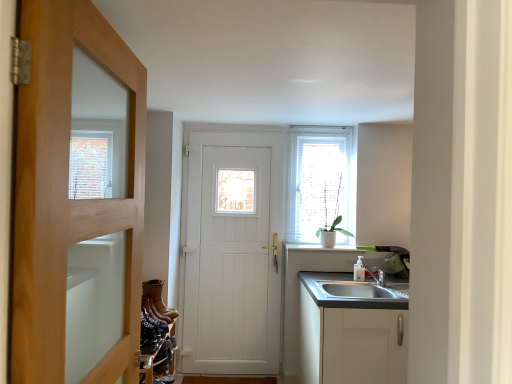
Question: Is wooden door at left, acting as the 1th door starting from the front, aimed at leather boots at lower left, the first shoe when ordered from back to front?

Choices:
 (A) no
 (B) yes

Answer: (A)

Question: Is wooden door at left, acting as the 1th door starting from the front, located outside leather boots at lower left, the first shoe positioned from the top?

Choices:
 (A) yes
 (B) no

Answer: (A)

Question: Does wooden door at left, acting as the 1th door starting from the front, lie in front of leather boots at lower left, which ranks as the 4th shoe in front-to-back order?

Choices:
 (A) yes
 (B) no

Answer: (A)

Question: Is wooden door at left, marked as the 2th door in a back-to-front arrangement, bigger than leather boots at lower left, positioned as the 4th shoe in bottom-to-top order?

Choices:
 (A) yes
 (B) no

Answer: (A)

Question: Is wooden door at left, acting as the 1th door starting from the front, to the left of leather boots at lower left, which ranks as the 4th shoe in front-to-back order, from the viewer's perspective?

Choices:
 (A) yes
 (B) no

Answer: (B)

Question: Is wooden door at left, marked as the 2th door in a back-to-front arrangement, in front of or behind white ceramic plant at upper right in the image?

Choices:
 (A) front
 (B) behind

Answer: (A)

Question: Looking at their shapes, would you say wooden door at left, marked as the 2th door in a back-to-front arrangement, is wider or thinner than white ceramic plant at upper right?

Choices:
 (A) thin
 (B) wide

Answer: (A)

Question: Is wooden door at left, acting as the 1th door starting from the front, bigger or smaller than white ceramic plant at upper right?

Choices:
 (A) big
 (B) small

Answer: (A)

Question: Is point (126, 294) closer or farther from the camera than point (339, 183)?

Choices:
 (A) closer
 (B) farther

Answer: (A)

Question: From the image's perspective, is white wooden door at center, which appears as the second door when viewed from the front, above or below white matte cabinet at lower right?

Choices:
 (A) below
 (B) above

Answer: (B)

Question: Considering the positions of white wooden door at center, which is the 1th door in back-to-front order, and white matte cabinet at lower right in the image, is white wooden door at center, which is the 1th door in back-to-front order, taller or shorter than white matte cabinet at lower right?

Choices:
 (A) tall
 (B) short

Answer: (A)

Question: Considering the positions of white wooden door at center, which appears as the second door when viewed from the front, and white matte cabinet at lower right in the image, is white wooden door at center, which appears as the second door when viewed from the front, wider or thinner than white matte cabinet at lower right?

Choices:
 (A) thin
 (B) wide

Answer: (A)

Question: From a real-world perspective, is white wooden door at center, which appears as the second door when viewed from the front, above or below white matte cabinet at lower right?

Choices:
 (A) below
 (B) above

Answer: (B)

Question: Is white textured window at upper right to the left or to the right of leather at lower left, arranged as the second shoe when ordered from the bottom, in the image?

Choices:
 (A) right
 (B) left

Answer: (A)

Question: Relative to leather at lower left, the 1th shoe viewed from the front, is white textured window at upper right in front or behind?

Choices:
 (A) front
 (B) behind

Answer: (B)